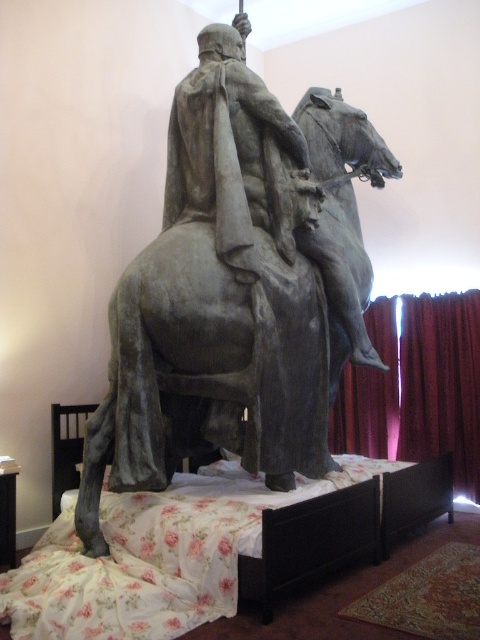
You are an interior designer arranging furniture in a room with a gray stone statue at center and a floral fabric bed at center. According to the scene, where should you place the statue relative to the bed to match the existing layout?

Result: The gray stone statue at center should be placed to the left of the floral fabric bed at center to match the existing layout.

You are a tour guide leading a group through a museum. You need to move a small cart that is 1.2 meters wide between the gray stone statue at center and the floral fabric bed at center. Can you fit the cart through the space between them?

The gray stone statue at center is 1.18 meters away from the floral fabric bed at center. Since the cart is 1.2 meters wide, it is slightly wider than the available space, so the cart cannot fit through the space between them.

You are an art curator standing in front of the gray stone statue at center and the floral fabric bed at center. Which object is closer to you?

The gray stone statue at center is closer to you than the floral fabric bed at center.